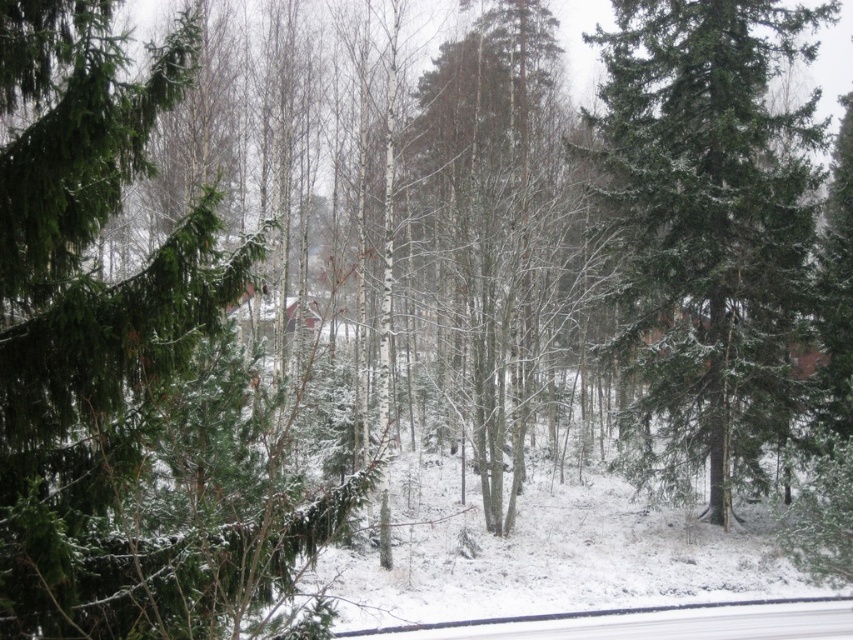
Is green matte tree at left bigger than green matte tree at center?

Incorrect, green matte tree at left is not larger than green matte tree at center.

The image size is (853, 640). What do you see at coordinates (131, 372) in the screenshot?
I see `green matte tree at left` at bounding box center [131, 372].

The image size is (853, 640). Identify the location of green matte tree at left. (131, 372).